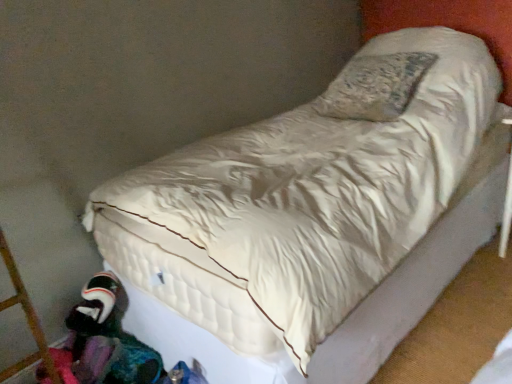
Question: Does multicolored fabric at lower left come in front of plush fabric toy at lower left?

Choices:
 (A) no
 (B) yes

Answer: (B)

Question: Does multicolored fabric at lower left have a lesser height compared to plush fabric toy at lower left?

Choices:
 (A) yes
 (B) no

Answer: (A)

Question: Considering the relative sizes of multicolored fabric at lower left and plush fabric toy at lower left in the image provided, is multicolored fabric at lower left bigger than plush fabric toy at lower left?

Choices:
 (A) no
 (B) yes

Answer: (B)

Question: Is multicolored fabric at lower left smaller than plush fabric toy at lower left?

Choices:
 (A) yes
 (B) no

Answer: (B)

Question: Is multicolored fabric at lower left outside of plush fabric toy at lower left?

Choices:
 (A) no
 (B) yes

Answer: (B)

Question: Is multicolored fabric at lower left placed right next to plush fabric toy at lower left?

Choices:
 (A) yes
 (B) no

Answer: (B)

Question: Is plush fabric toy at lower left looking in the opposite direction of multicolored fabric at lower left?

Choices:
 (A) yes
 (B) no

Answer: (B)

Question: Considering the relative sizes of plush fabric toy at lower left and multicolored fabric at lower left in the image provided, is plush fabric toy at lower left taller than multicolored fabric at lower left?

Choices:
 (A) no
 (B) yes

Answer: (B)

Question: Can you confirm if plush fabric toy at lower left is positioned to the right of multicolored fabric at lower left?

Choices:
 (A) no
 (B) yes

Answer: (A)

Question: From a real-world perspective, is plush fabric toy at lower left on multicolored fabric at lower left?

Choices:
 (A) yes
 (B) no

Answer: (A)

Question: Is plush fabric toy at lower left next to multicolored fabric at lower left?

Choices:
 (A) yes
 (B) no

Answer: (B)

Question: Is the depth of plush fabric toy at lower left greater than that of multicolored fabric at lower left?

Choices:
 (A) yes
 (B) no

Answer: (A)

Question: From the image's perspective, is multicolored fabric at lower left located above or below plush fabric toy at lower left?

Choices:
 (A) above
 (B) below

Answer: (B)